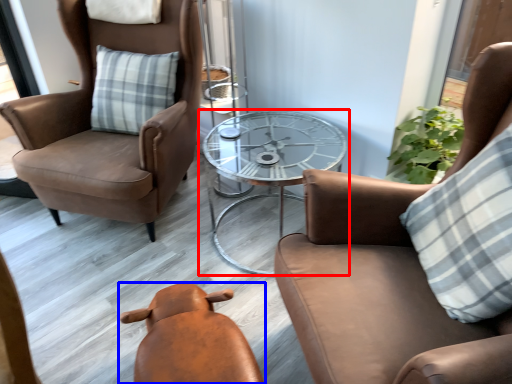
Question: Which of the following is the closest to the observer, table (highlighted by a red box) or chair (highlighted by a blue box)?

Choices:
 (A) table
 (B) chair

Answer: (B)